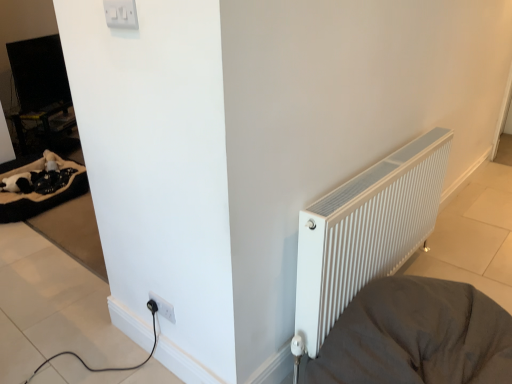
Question: From the image's perspective, is soft beige fabric at left located above or below wooden table at left?

Choices:
 (A) below
 (B) above

Answer: (A)

Question: Based on their sizes in the image, would you say soft beige fabric at left is bigger or smaller than wooden table at left?

Choices:
 (A) big
 (B) small

Answer: (A)

Question: Which is farther from the white plastic switch at upper center, which is counted as the 1th electric outlet, starting from the front?

Choices:
 (A) soft beige fabric at left
 (B) white ribbed radiator at right
 (C) wooden table at left
 (D) white plastic electric outlet at lower left, which is the first electric outlet from back to front
 (E) white ribbed radiator at right

Answer: (C)

Question: Based on their relative distances, which object is farther from the white ribbed radiator at right?

Choices:
 (A) white plastic electric outlet at lower left, which is the 2th electric outlet from top to bottom
 (B) soft beige fabric at left
 (C) white ribbed radiator at right
 (D) wooden table at left
 (E) white plastic switch at upper center, placed as the 2th electric outlet when sorted from back to front

Answer: (D)